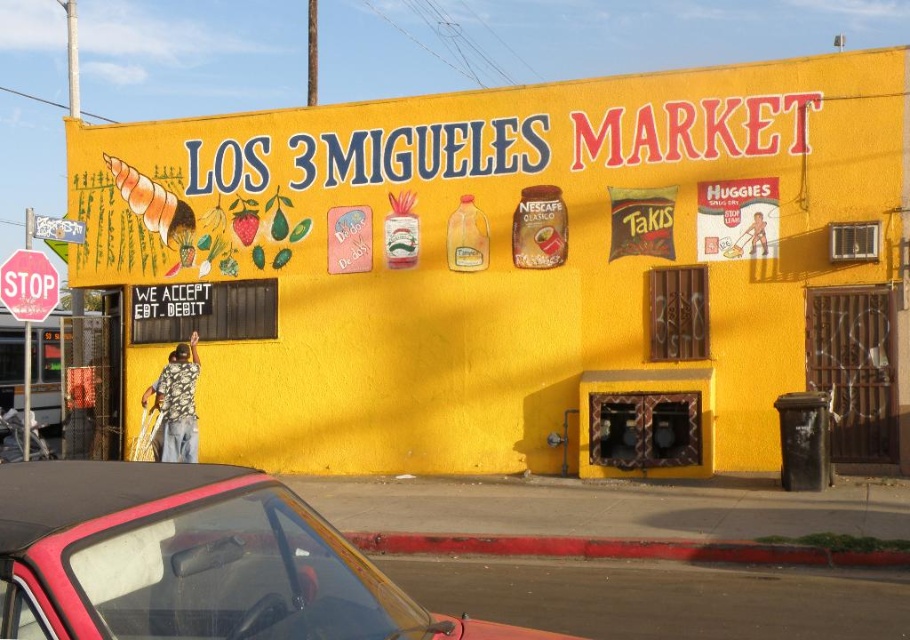
Question: Which point appears farthest from the camera in this image?

Choices:
 (A) (62, 595)
 (B) (47, 316)
 (C) (211, 400)

Answer: (C)

Question: Which point is closer to the camera?

Choices:
 (A) red plastic stop sign at left
 (B) yellow matte building at center
 (C) shiny red convertible at lower left

Answer: (C)

Question: Is yellow matte building at center wider than shiny red convertible at lower left?

Choices:
 (A) yes
 (B) no

Answer: (A)

Question: Is yellow matte building at center positioned in front of red plastic stop sign at left?

Choices:
 (A) no
 (B) yes

Answer: (A)

Question: Can you confirm if yellow matte building at center is positioned to the right of red plastic stop sign at left?

Choices:
 (A) no
 (B) yes

Answer: (B)

Question: Based on their relative distances, which object is farther from the red plastic stop sign at left?

Choices:
 (A) shiny red convertible at lower left
 (B) yellow matte building at center

Answer: (A)